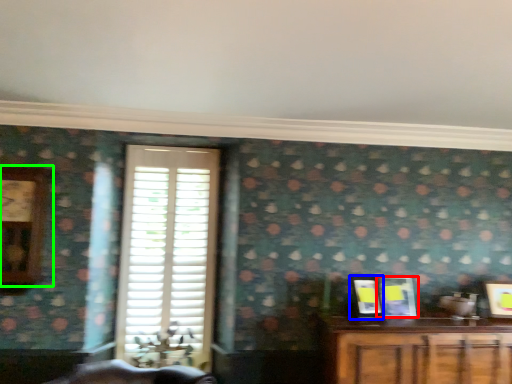
Question: Which is farther away from picture frame (highlighted by a red box)? picture frame (highlighted by a blue box) or clock (highlighted by a green box)?

Choices:
 (A) picture frame
 (B) clock

Answer: (B)